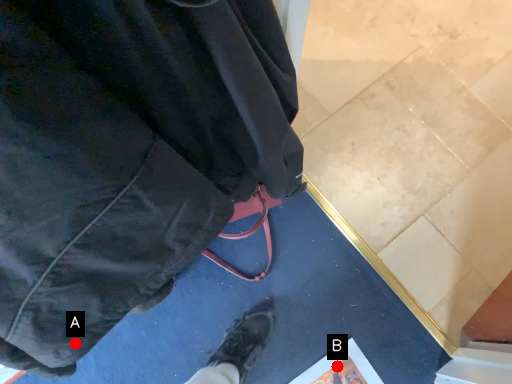
Question: Two points are circled on the image, labeled by A and B beside each circle. Which point is farther to the camera?

Choices:
 (A) A is further
 (B) B is further

Answer: (B)